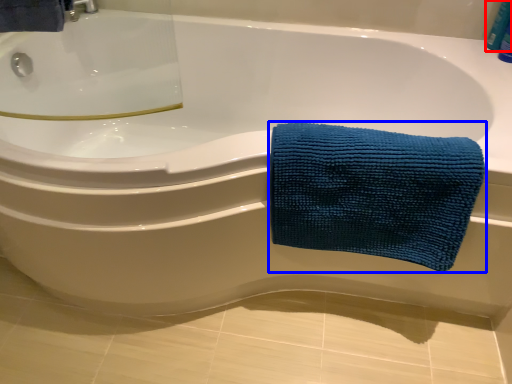
Question: Which point is further to the camera, toiletry (highlighted by a red box) or towel (highlighted by a blue box)?

Choices:
 (A) toiletry
 (B) towel

Answer: (A)